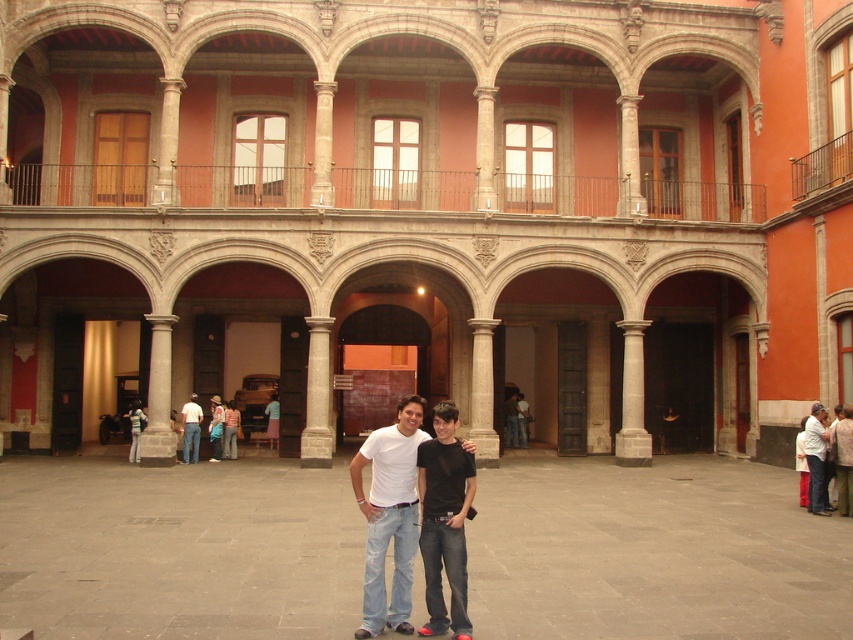
Between white matte t-shirt at center and denim jacket at center, which one appears on the left side from the viewer's perspective?

denim jacket at center is more to the left.

Image resolution: width=853 pixels, height=640 pixels. In order to click on white matte t-shirt at center in this screenshot , I will do `click(389, 515)`.

Who is more forward, (415, 554) or (219, 422)?

Positioned in front is point (415, 554).

You are a GUI agent. You are given a task and a screenshot of the screen. Output one action in this format:
    pyautogui.click(x=<x>, y=<y>)
    Task: Click on the white matte t-shirt at center
    The height and width of the screenshot is (640, 853).
    Given the screenshot: What is the action you would take?
    pyautogui.click(x=389, y=515)

Does point (405, 628) lie behind point (227, 436)?

No, it is not.

Is white matte t-shirt at center bigger than denim jeans at center?

Indeed, white matte t-shirt at center has a larger size compared to denim jeans at center.

Does point (401, 428) lie in front of point (227, 417)?

Yes, it is in front of point (227, 417).

Where is `white matte t-shirt at center`? white matte t-shirt at center is located at coordinates (389, 515).

How far apart are white cotton shirt at center and denim jeans at center?

white cotton shirt at center and denim jeans at center are 29.70 meters apart.

Is point (810, 493) more distant than point (231, 444)?

No, (810, 493) is closer to viewer.

This screenshot has width=853, height=640. In order to click on white cotton shirt at center in this screenshot , I will do `click(816, 460)`.